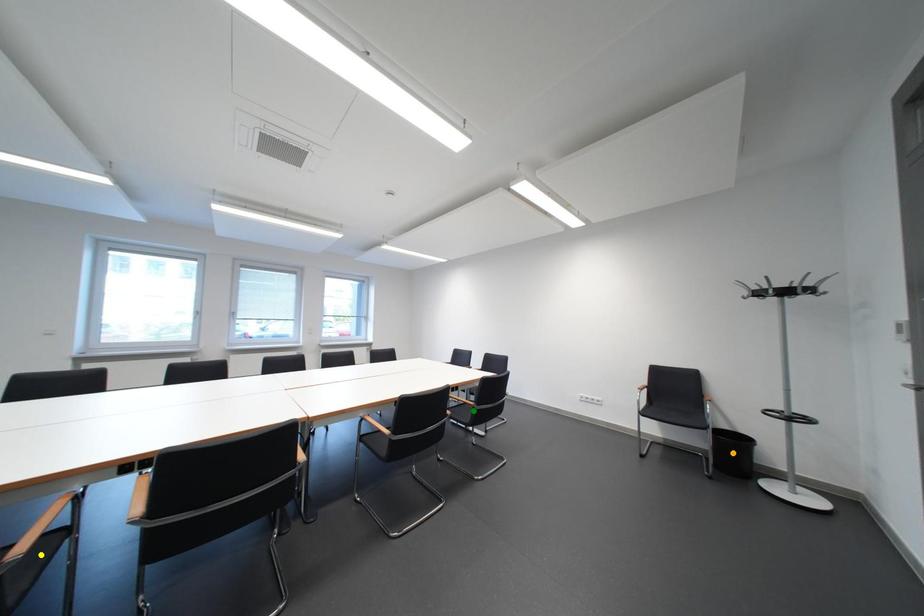
Based on the photo, order these from farthest to nearest:
- yellow point
- orange point
- green point

green point → orange point → yellow point